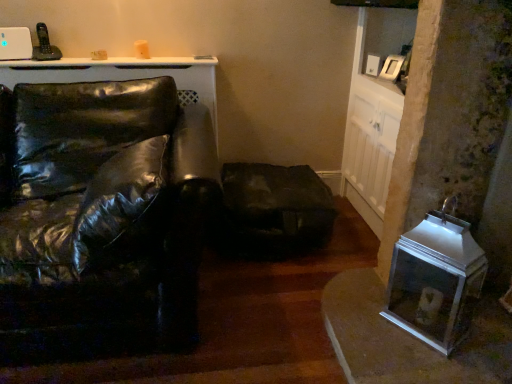
The image size is (512, 384). Find the location of `vacant space that is in between dark brown leather swivel chair at center and glossy black leather couch at left`. vacant space that is in between dark brown leather swivel chair at center and glossy black leather couch at left is located at coordinates (267, 298).